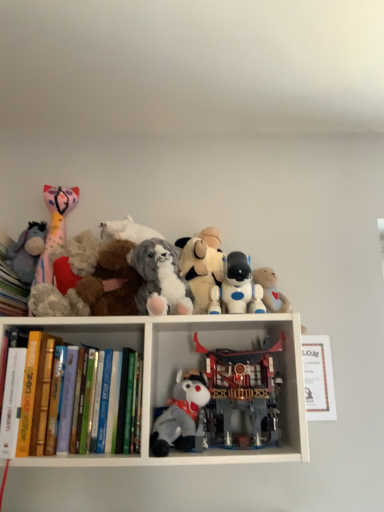
Question: In terms of width, does white matte books at upper left look wider or thinner when compared to white plastic robot at center, arranged as the second toy when viewed from the right?

Choices:
 (A) wide
 (B) thin

Answer: (A)

Question: Considering the positions of white matte books at upper left and white plastic robot at center, arranged as the second toy when viewed from the right, in the image, is white matte books at upper left taller or shorter than white plastic robot at center, arranged as the second toy when viewed from the right,?

Choices:
 (A) tall
 (B) short

Answer: (A)

Question: Which object is the farthest from the fluffy gray plush at center, which ranks as the 3th toy in left-to-right order?

Choices:
 (A) wooden bear at upper center, the 1th toy from the right
 (B) plush purple at left, which is the 1th toy from left to right
 (C) fluffy beige stuffed animal at center, the fourth toy positioned from the right
 (D) hardcover book at left, arranged as the second book when ordered from the bottom
 (E) white paper at upper center, positioned as the 3th paperback book in left-to-right order

Answer: (E)

Question: Which is nearer to the hardcover book at left, which is the second paperback book from left to right?

Choices:
 (A) white plastic robot at center, positioned as the 7th toy in left-to-right order
 (B) fluffy pink and white plush toy at left, arranged as the 2th toy when viewed from the left
 (C) plush purple at left, which is the 1th toy from left to right
 (D) wooden bear at upper center, which is the eighth toy from left to right
 (E) hardcover books at left, the first book ordered from the bottom

Answer: (E)